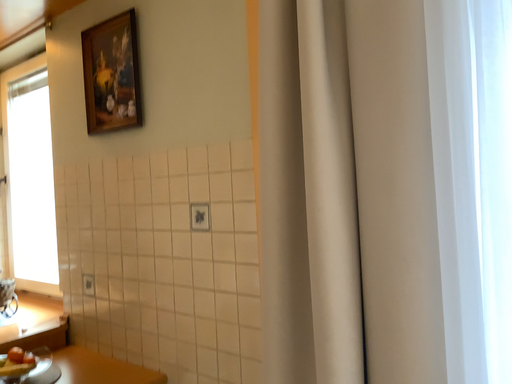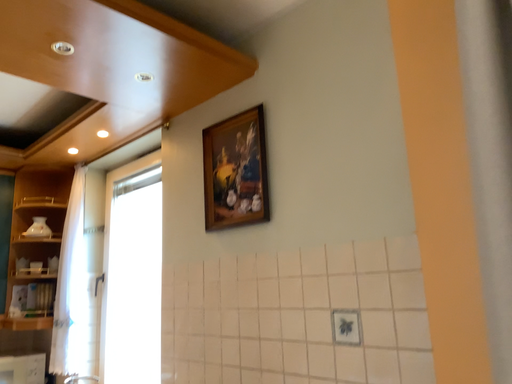
Question: How did the camera likely rotate when shooting the video?

Choices:
 (A) rotated right
 (B) rotated left

Answer: (B)